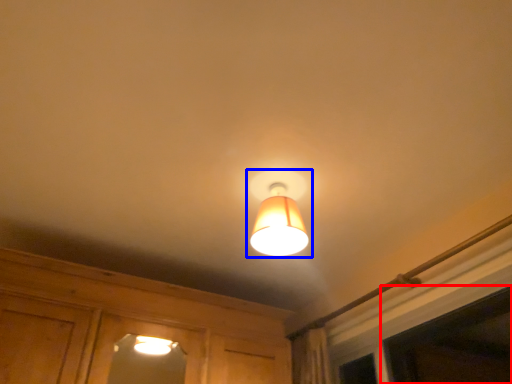
Question: Which point is closer to the camera, window (highlighted by a red box) or lamp (highlighted by a blue box)?

Choices:
 (A) window
 (B) lamp

Answer: (A)